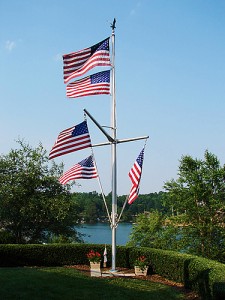
Where is `plant with red flowers`? This screenshot has height=300, width=225. plant with red flowers is located at coordinates (143, 259), (93, 253).